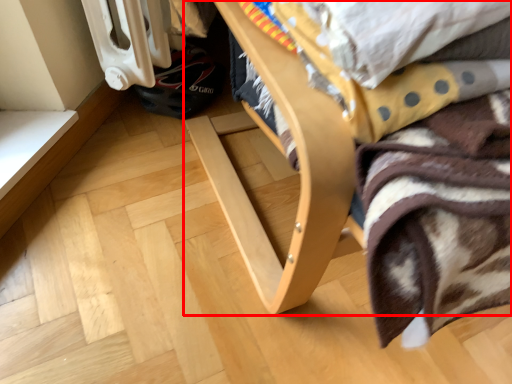
Question: From the image's perspective, where is furniture (annotated by the red box) located in relation to blanket in the image?

Choices:
 (A) below
 (B) above

Answer: (B)